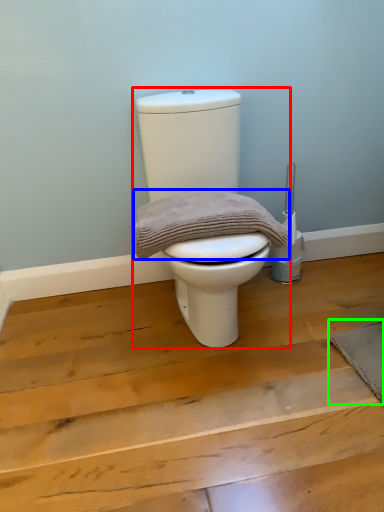
Question: Considering the real-world distances, which object is closest to toilet (highlighted by a red box)? material (highlighted by a blue box) or doormat (highlighted by a green box).

Choices:
 (A) material
 (B) doormat

Answer: (A)